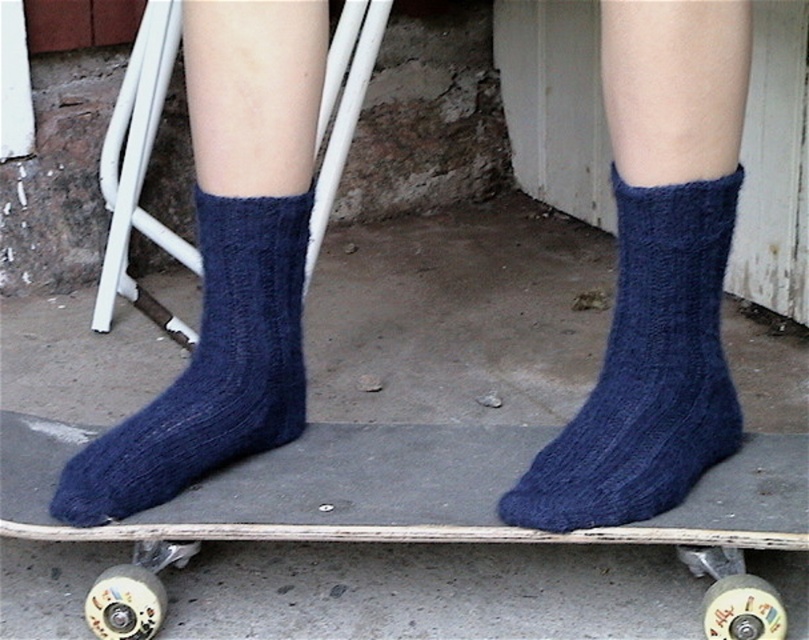
Question: Which point appears farthest from the camera in this image?

Choices:
 (A) (488, 468)
 (B) (695, 468)

Answer: (A)

Question: Is navy blue knitted socks at center positioned before dark blue knitted socks at center?

Choices:
 (A) no
 (B) yes

Answer: (B)

Question: Among these objects, which one is nearest to the camera?

Choices:
 (A) dark blue knitted sock at center
 (B) navy blue knitted socks at center

Answer: (B)

Question: Which of the following is the closest to the observer?

Choices:
 (A) navy blue knitted socks at center
 (B) dark blue knitted sock at center
 (C) dark blue knitted sock at lower left
 (D) dark blue knitted socks at center

Answer: (A)

Question: Can you confirm if dark blue knitted sock at center is positioned below dark blue knitted sock at lower left?

Choices:
 (A) yes
 (B) no

Answer: (B)

Question: Does dark blue knitted socks at center appear over dark blue knitted sock at lower left?

Choices:
 (A) yes
 (B) no

Answer: (B)